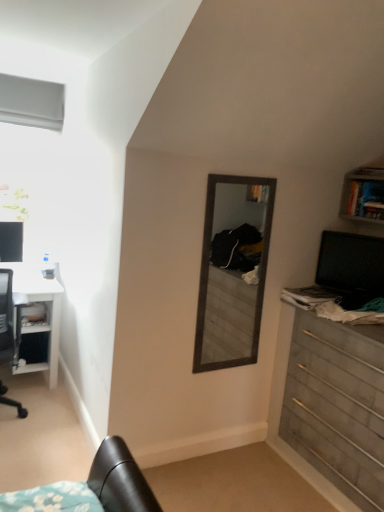
Question: Considering the relative sizes of wooden chest of drawers at right and white glossy desk at left in the image provided, is wooden chest of drawers at right thinner than white glossy desk at left?

Choices:
 (A) no
 (B) yes

Answer: (B)

Question: Is wooden chest of drawers at right facing towards white glossy desk at left?

Choices:
 (A) no
 (B) yes

Answer: (A)

Question: From a real-world perspective, is wooden chest of drawers at right physically below white glossy desk at left?

Choices:
 (A) no
 (B) yes

Answer: (A)

Question: Is wooden chest of drawers at right outside white glossy desk at left?

Choices:
 (A) yes
 (B) no

Answer: (A)

Question: Does wooden chest of drawers at right contain white glossy desk at left?

Choices:
 (A) no
 (B) yes

Answer: (A)

Question: Does point (296, 425) appear closer or farther from the camera than point (21, 223)?

Choices:
 (A) farther
 (B) closer

Answer: (B)

Question: In terms of height, does wooden chest of drawers at right look taller or shorter compared to matte black monitor at left, the second computer monitor viewed from the front?

Choices:
 (A) tall
 (B) short

Answer: (A)

Question: Relative to matte black monitor at left, the 1th computer monitor positioned from the back, is wooden chest of drawers at right in front or behind?

Choices:
 (A) behind
 (B) front

Answer: (B)

Question: Considering the relative positions of wooden chest of drawers at right and matte black monitor at left, the second computer monitor when ordered from right to left, in the image provided, is wooden chest of drawers at right to the left or to the right of matte black monitor at left, the second computer monitor when ordered from right to left,?

Choices:
 (A) left
 (B) right

Answer: (B)

Question: In the image, is white matte window at upper left positioned in front of or behind wooden chest of drawers at right?

Choices:
 (A) front
 (B) behind

Answer: (B)

Question: Considering the positions of point (54, 117) and point (339, 460), is point (54, 117) closer or farther from the camera than point (339, 460)?

Choices:
 (A) closer
 (B) farther

Answer: (B)

Question: Looking at their shapes, would you say white matte window at upper left is wider or thinner than wooden chest of drawers at right?

Choices:
 (A) thin
 (B) wide

Answer: (A)

Question: Would you say white matte window at upper left is inside or outside wooden chest of drawers at right?

Choices:
 (A) outside
 (B) inside

Answer: (A)

Question: Considering the positions of point (11, 245) and point (28, 118), is point (11, 245) closer or farther from the camera than point (28, 118)?

Choices:
 (A) farther
 (B) closer

Answer: (B)

Question: Is matte black monitor at left, acting as the first computer monitor starting from the left, wider or thinner than white matte window at upper left?

Choices:
 (A) wide
 (B) thin

Answer: (B)